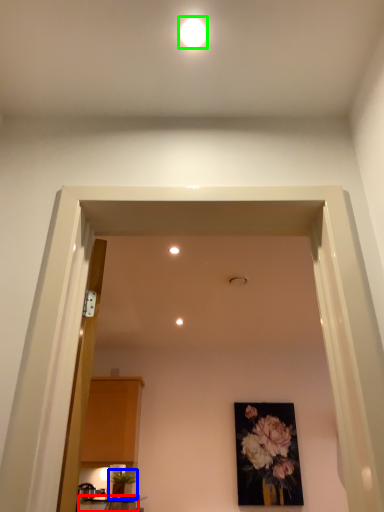
Question: Which is farther away from table (highlighted by a red box)? houseplant (highlighted by a blue box) or lighting (highlighted by a green box)?

Choices:
 (A) houseplant
 (B) lighting

Answer: (B)